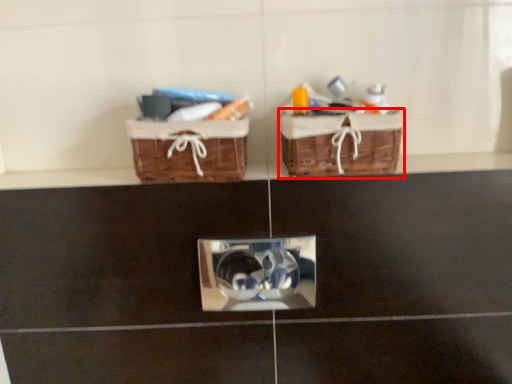
Question: Observing the image, what is the correct spatial positioning of picnic basket (annotated by the red box) in reference to picnic basket?

Choices:
 (A) left
 (B) right

Answer: (B)